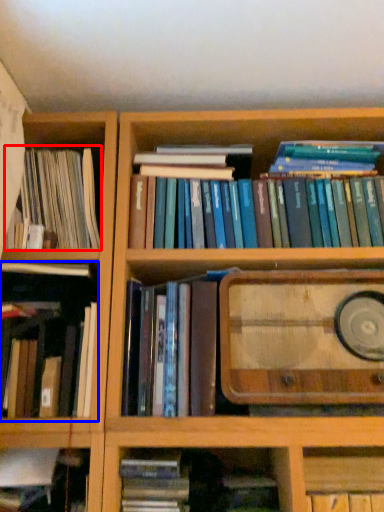
Question: Which point is closer to the camera, book (highlighted by a red box) or book (highlighted by a blue box)?

Choices:
 (A) book
 (B) book

Answer: (B)